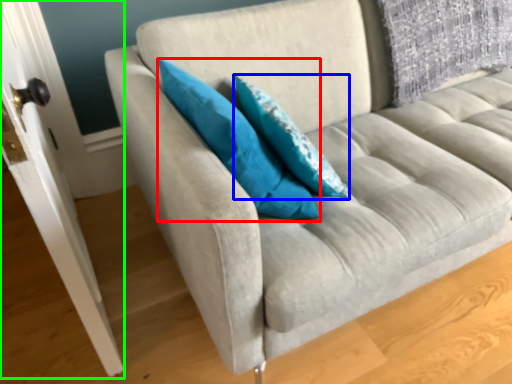
Question: Which object is the closest to the pillow (highlighted by a red box)? Choose among these: pillow (highlighted by a blue box) or door (highlighted by a green box).

Choices:
 (A) pillow
 (B) door

Answer: (A)